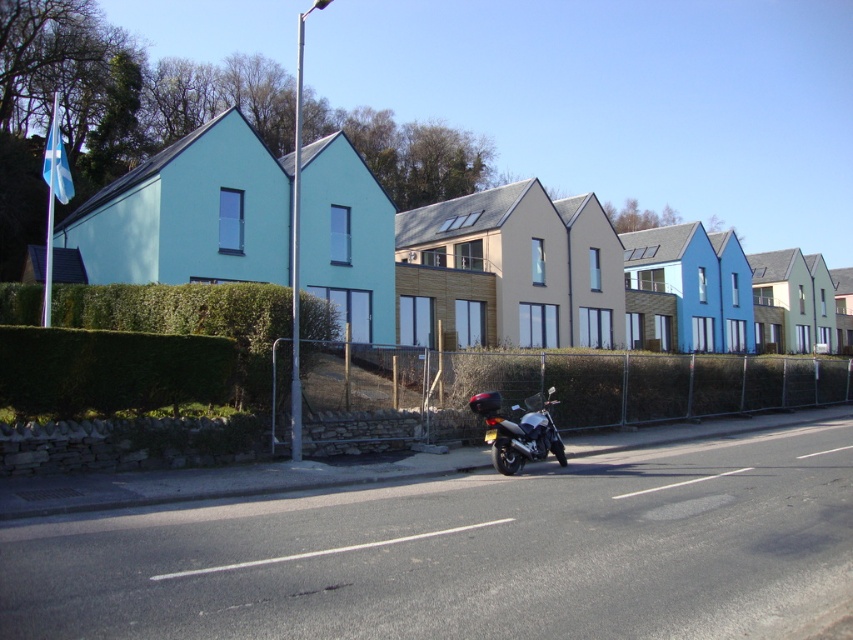
You are standing on the residential street and want to walk from point (131, 317) to point (477, 524). Which point is closer to you when you start?

Point (131, 317) is closer to you because it is further to the viewer than point (477, 524), so when you start at point (131, 317), it is already near you, and you need to move towards point (477, 524) which is farther away.

You are a delivery driver who needs to park your silver metallic motorcycle at center on the right side of the white asphalt road at center. According to the scene description, is there enough space between the motorcycle and the chain link fence to safely open the side storage compartment?

The silver metallic motorcycle at center is positioned on the right side of white asphalt road at center. Since the chain link fence is parallel to the road, there should be sufficient space between the motorcycle and the fence to safely open the side storage compartment.

You are standing at the point with coordinates point (529, 397) and want to walk to the point with coordinates point (277, 364). Which direction should you move?

You should move forward because point (277, 364) is in front of point (529, 397).